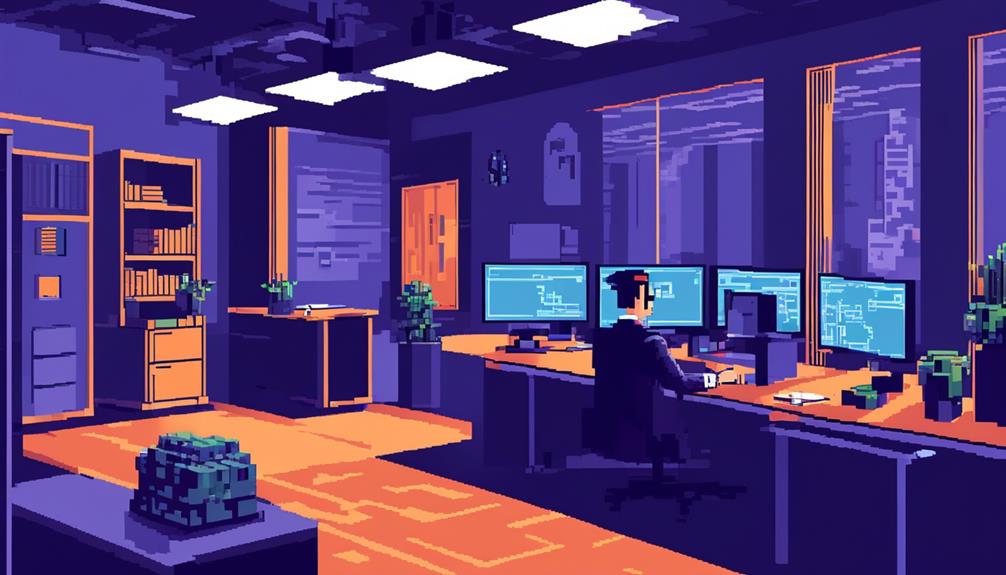
Where is `lights in ceiling`? The image size is (1006, 575). lights in ceiling is located at coordinates (208, 124), (316, 91), (409, 74), (594, 33).